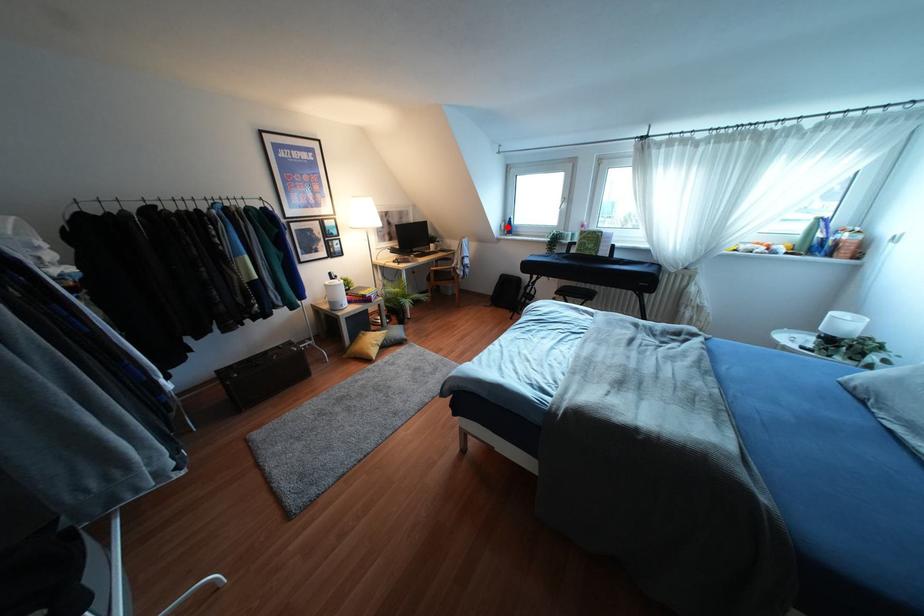
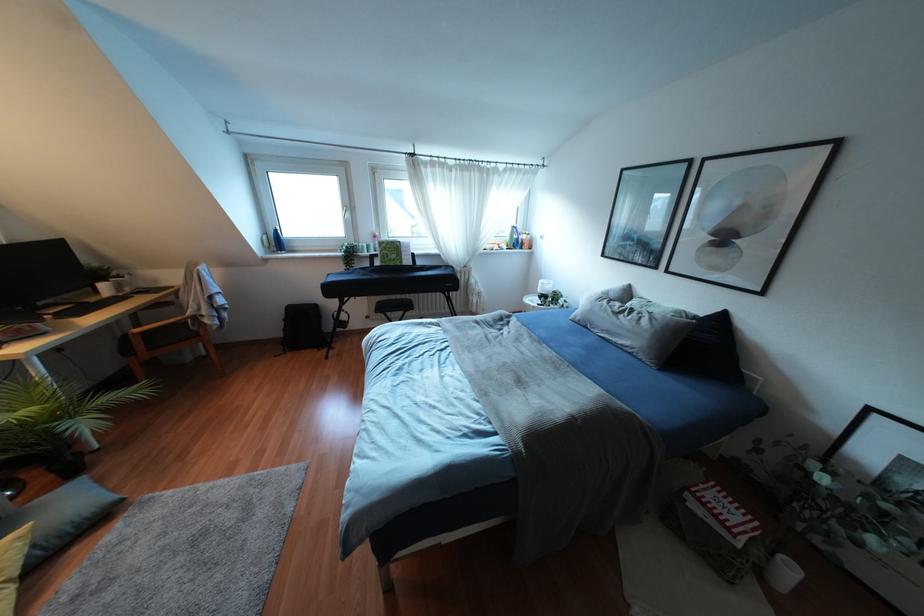
Locate, in the second image, the point that corresponds to the highlighted location in the first image.

(275, 241)